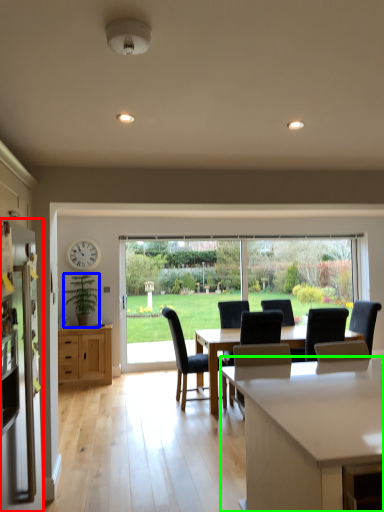
Question: Based on their relative distances, which object is nearer to refrigerator (highlighted by a red box)? Choose from houseplant (highlighted by a blue box) and countertop (highlighted by a green box).

Choices:
 (A) houseplant
 (B) countertop

Answer: (B)